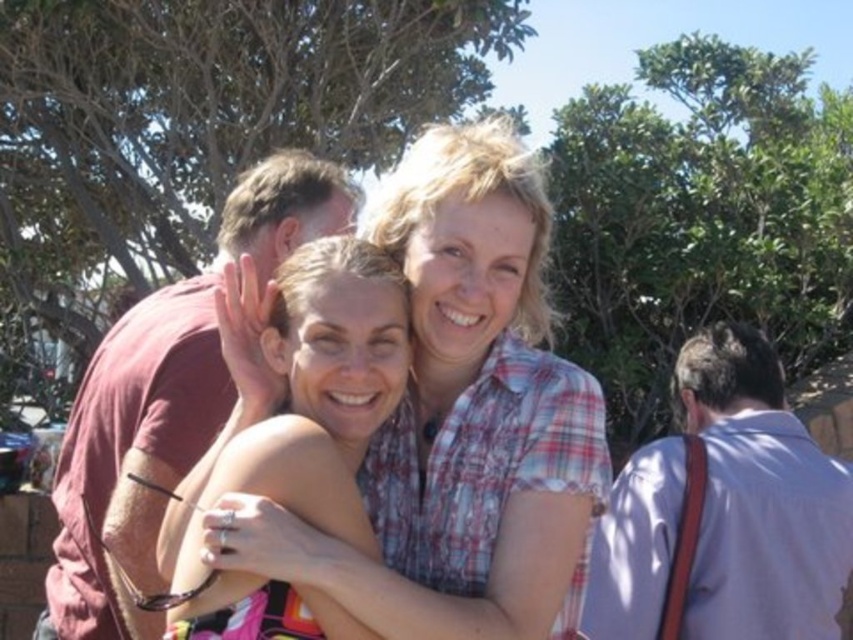
Between point (370, 515) and point (229, 456), which one is positioned behind?

The point (370, 515) is behind.

Is plaid shirt at center below matte skin at center?

No.

Between point (453, 355) and point (381, 374), which one is positioned in front?

Point (381, 374) is in front.

This screenshot has height=640, width=853. In order to click on plaid shirt at center in this screenshot , I will do `click(462, 419)`.

Consider the image. Is plaid shirt at center to the right of light gray shirt at right from the viewer's perspective?

No, plaid shirt at center is not to the right of light gray shirt at right.

Looking at this image, who is more forward, (473, 163) or (624, 508)?

Point (473, 163)

What do you see at coordinates (462, 419) in the screenshot? I see `plaid shirt at center` at bounding box center [462, 419].

Locate an element on the screen. This screenshot has width=853, height=640. plaid shirt at center is located at coordinates (462, 419).

Between light gray shirt at right and matte skin at center, which one appears on the right side from the viewer's perspective?

light gray shirt at right is more to the right.

You are a GUI agent. You are given a task and a screenshot of the screen. Output one action in this format:
    pyautogui.click(x=<x>, y=<y>)
    Task: Click on the light gray shirt at right
    The height and width of the screenshot is (640, 853).
    Given the screenshot: What is the action you would take?
    pyautogui.click(x=759, y=499)

Describe the element at coordinates (759, 499) in the screenshot. Image resolution: width=853 pixels, height=640 pixels. I see `light gray shirt at right` at that location.

Locate an element on the screen. light gray shirt at right is located at coordinates (759, 499).